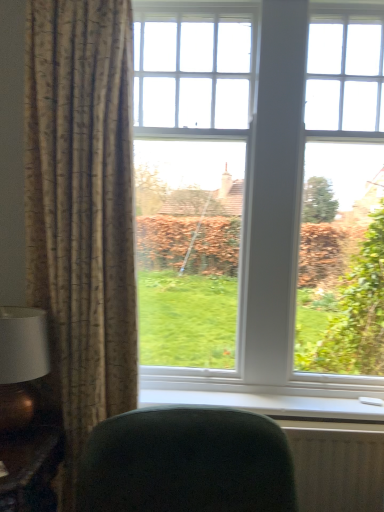
Question: Would you say white plastic window sill at lower center is inside or outside dark green fabric chair at lower center?

Choices:
 (A) inside
 (B) outside

Answer: (B)

Question: From a real-world perspective, relative to dark green fabric chair at lower center, is white plastic window sill at lower center vertically above or below?

Choices:
 (A) above
 (B) below

Answer: (A)

Question: Considering the real-world distances, which object is farthest from the clear glass window at center?

Choices:
 (A) white plastic window sill at lower center
 (B) matte gold table lamp at left
 (C) dark green fabric chair at lower center
 (D) textured beige curtain at left
 (E) wooden table at lower left

Answer: (E)

Question: Considering the real-world distances, which object is closest to the white plastic window sill at lower center?

Choices:
 (A) dark green fabric chair at lower center
 (B) matte gold table lamp at left
 (C) textured beige curtain at left
 (D) clear glass window at center
 (E) wooden table at lower left

Answer: (A)